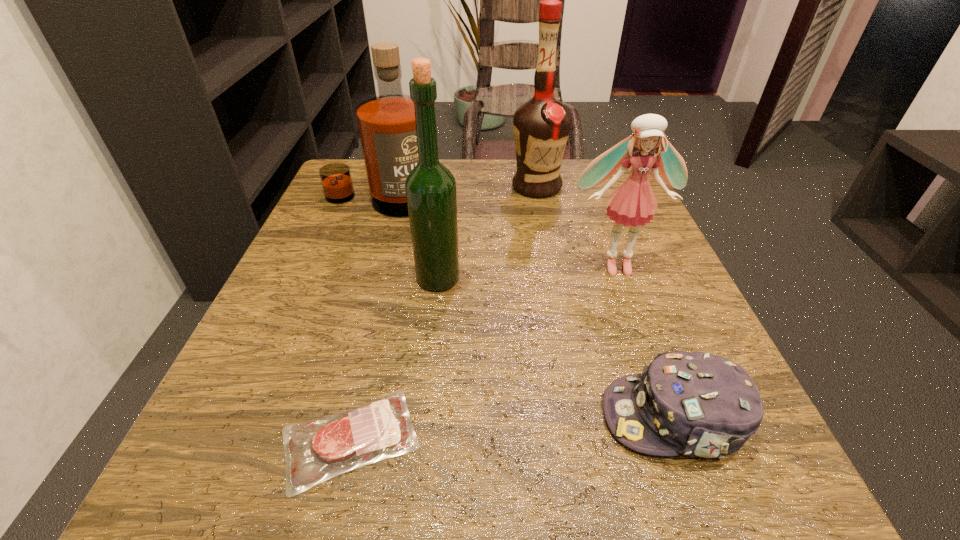
The image size is (960, 540). Identify the location of the rightmost liquor. (541, 126).

The height and width of the screenshot is (540, 960). I want to click on the nearest liquor, so click(x=430, y=187).

Identify the location of doll. The height and width of the screenshot is (540, 960). (633, 203).

At what (x,y) coordinates should I click in order to perform the action: click on the fifth tallest object. Please return your answer as a coordinate pair (x, y). The image size is (960, 540). Looking at the image, I should click on (699, 404).

Where is `steak`? The image size is (960, 540). steak is located at coordinates (315, 451).

Image resolution: width=960 pixels, height=540 pixels. What are the coordinates of `free space located on the front and back of the rightmost liquor` in the screenshot? It's located at (547, 247).

Identify the location of free space located on the front of the nearest liquor. The image size is (960, 540). (415, 492).

This screenshot has width=960, height=540. I want to click on free space located 0.200m on the front-facing side of the doll, so click(x=656, y=373).

At what (x,y) coordinates should I click in order to perform the action: click on free space located 0.300m on the front-facing side of the fifth tallest object. Please return your answer as a coordinate pair (x, y). The width and height of the screenshot is (960, 540). Looking at the image, I should click on (372, 417).

Where is `free region located 0.400m on the front-facing side of the fifth tallest object`? This screenshot has width=960, height=540. free region located 0.400m on the front-facing side of the fifth tallest object is located at coordinates tap(295, 417).